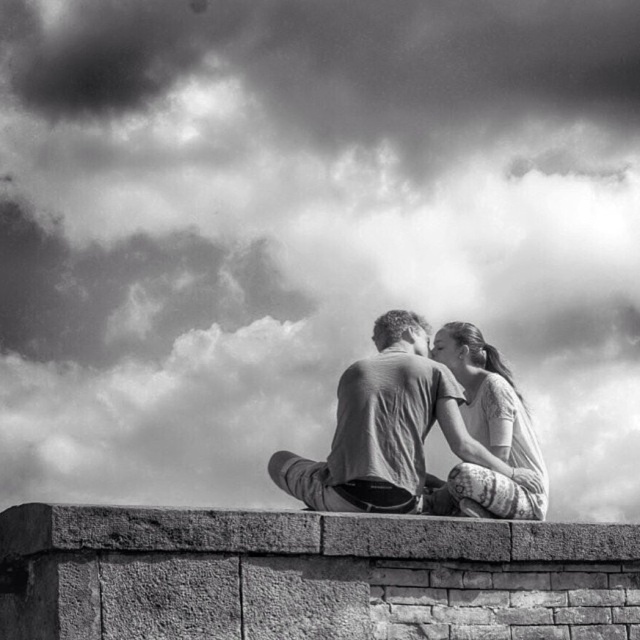
You are an interior designer planning to place a brick at center and a patterned fabric dress at center in a room. Given their sizes, which object should you place closer to the entrance to ensure the dress is not overwhelmed by the brick?

The brick at center is larger than the patterned fabric dress at center. To prevent the dress from being overwhelmed, place the brick at center farther from the entrance and the patterned fabric dress at center closer to the entrance.

You are standing at the position of point (400, 392) and want to move to the position of point (502, 573). Is the path from your current position to the target position clear of any obstacles?

Point (502, 573) is in front of point (400, 392), so the path between them is clear of obstacles.